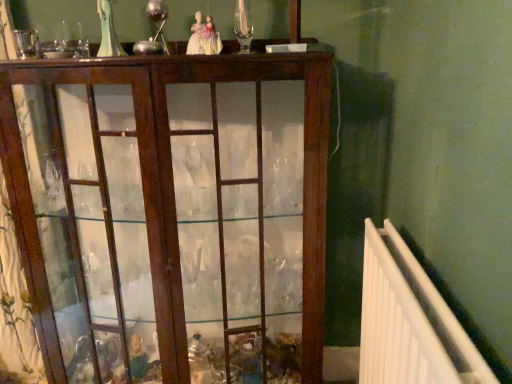
In order to face white plastic radiator at right, should I rotate leftwards or rightwards?

Rotate right and turn 18.688 degrees.

Identify the location of white plastic radiator at right. This screenshot has width=512, height=384. (410, 321).

Describe the element at coordinates (410, 321) in the screenshot. The width and height of the screenshot is (512, 384). I see `white plastic radiator at right` at that location.

Measure the distance between point (186, 105) and camera.

The distance of point (186, 105) from camera is 1.05 meters.

This screenshot has height=384, width=512. In order to click on mahogany glass cabinet at center in this screenshot , I will do [x=170, y=213].

What do you see at coordinates (170, 213) in the screenshot? I see `mahogany glass cabinet at center` at bounding box center [170, 213].

At what (x,y) coordinates should I click in order to perform the action: click on white plastic radiator at right. Please return your answer as a coordinate pair (x, y). The image size is (512, 384). Looking at the image, I should click on (410, 321).

In the image, is mahogany glass cabinet at center on the left side or the right side of white plastic radiator at right?

In the image, mahogany glass cabinet at center appears on the left side of white plastic radiator at right.

Considering the positions of objects mahogany glass cabinet at center and white plastic radiator at right in the image provided, who is in front, mahogany glass cabinet at center or white plastic radiator at right?

white plastic radiator at right.

Is point (54, 136) closer or farther from the camera than point (389, 262)?

Point (54, 136) appears to be farther away from the viewer than point (389, 262).

From the image's perspective, which one is positioned lower, mahogany glass cabinet at center or white plastic radiator at right?

white plastic radiator at right, from the image's perspective.

From a real-world perspective, is mahogany glass cabinet at center physically below white plastic radiator at right?

Incorrect, from a real-world perspective, mahogany glass cabinet at center is higher than white plastic radiator at right.

In terms of width, does mahogany glass cabinet at center look wider or thinner when compared to white plastic radiator at right?

Clearly, mahogany glass cabinet at center has more width compared to white plastic radiator at right.

Between mahogany glass cabinet at center and white plastic radiator at right, which one has less height?

With less height is white plastic radiator at right.

In terms of size, does mahogany glass cabinet at center appear bigger or smaller than white plastic radiator at right?

Clearly, mahogany glass cabinet at center is larger in size than white plastic radiator at right.

Is mahogany glass cabinet at center not within white plastic radiator at right?

Yes.

Is mahogany glass cabinet at center placed right next to white plastic radiator at right?

mahogany glass cabinet at center and white plastic radiator at right are not in contact.

Is mahogany glass cabinet at center looking in the opposite direction of white plastic radiator at right?

mahogany glass cabinet at center does not have its back to white plastic radiator at right.

Can you tell me how much mahogany glass cabinet at center and white plastic radiator at right differ in facing direction?

mahogany glass cabinet at center and white plastic radiator at right are facing 90.5 degrees away from each other.

What are the coordinates of `furniture above the white plastic radiator at right (from a real-world perspective)` in the screenshot? It's located at (170, 213).

Between white plastic radiator at right and mahogany glass cabinet at center, which one appears on the left side from the viewer's perspective?

mahogany glass cabinet at center.

Considering the positions of objects white plastic radiator at right and mahogany glass cabinet at center in the image provided, who is in front, white plastic radiator at right or mahogany glass cabinet at center?

white plastic radiator at right is closer to the camera.

Does point (386, 304) appear closer or farther from the camera than point (122, 349)?

Clearly, point (386, 304) is closer to the camera than point (122, 349).

In the scene shown: From the image's perspective, which is above, white plastic radiator at right or mahogany glass cabinet at center?

mahogany glass cabinet at center, from the image's perspective.

From a real-world perspective, which is physically above, white plastic radiator at right or mahogany glass cabinet at center?

From a 3D spatial view, mahogany glass cabinet at center is above.

Can you confirm if white plastic radiator at right is wider than mahogany glass cabinet at center?

In fact, white plastic radiator at right might be narrower than mahogany glass cabinet at center.

In the scene shown: Which of these two, white plastic radiator at right or mahogany glass cabinet at center, stands taller?

mahogany glass cabinet at center.

Considering the sizes of objects white plastic radiator at right and mahogany glass cabinet at center in the image provided, who is bigger, white plastic radiator at right or mahogany glass cabinet at center?

mahogany glass cabinet at center is bigger.

Is white plastic radiator at right located outside mahogany glass cabinet at center?

white plastic radiator at right lies outside mahogany glass cabinet at center's area.

Is the surface of white plastic radiator at right in direct contact with mahogany glass cabinet at center?

No, white plastic radiator at right is not making contact with mahogany glass cabinet at center.

Is mahogany glass cabinet at center at the back of white plastic radiator at right?

No, white plastic radiator at right's orientation is not away from mahogany glass cabinet at center.

What's the angular difference between white plastic radiator at right and mahogany glass cabinet at center's facing directions?

There is a 90.5-degree angle between the facing directions of white plastic radiator at right and mahogany glass cabinet at center.

You are a GUI agent. You are given a task and a screenshot of the screen. Output one action in this format:
    pyautogui.click(x=<x>, y=<y>)
    Task: Click on the radiator in front of the mahogany glass cabinet at center
    Image resolution: width=512 pixels, height=384 pixels.
    Given the screenshot: What is the action you would take?
    pyautogui.click(x=410, y=321)

At what (x,y) coordinates should I click in order to perform the action: click on furniture on the left side of white plastic radiator at right. Please return your answer as a coordinate pair (x, y). The height and width of the screenshot is (384, 512). Looking at the image, I should click on (170, 213).

Find the location of a particular element. The height and width of the screenshot is (384, 512). radiator below the mahogany glass cabinet at center (from the image's perspective) is located at coordinates (410, 321).